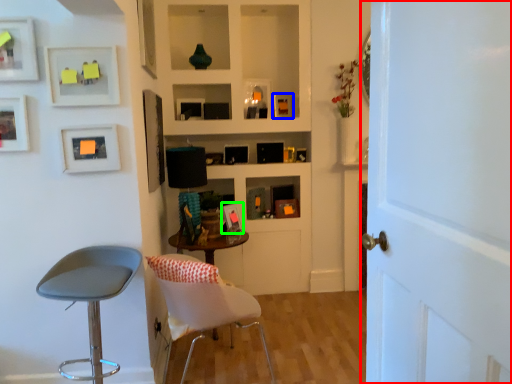
Question: Based on their relative distances, which object is nearer to door (highlighted by a red box)? Choose from picture frame (highlighted by a blue box) and picture frame (highlighted by a green box).

Choices:
 (A) picture frame
 (B) picture frame

Answer: (B)